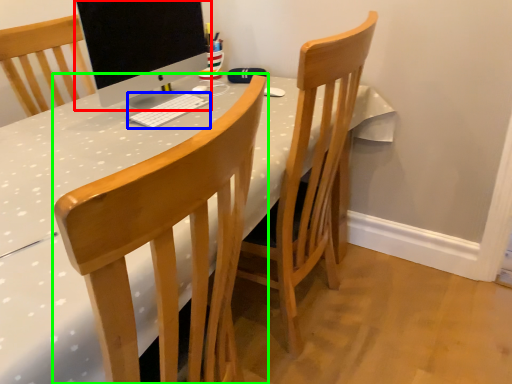
Question: Which is nearer to the computer monitor (highlighted by a red box)? computer keyboard (highlighted by a blue box) or chair (highlighted by a green box).

Choices:
 (A) computer keyboard
 (B) chair

Answer: (A)